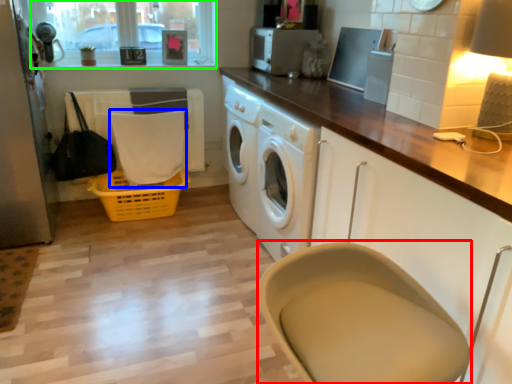
Question: Estimate the real-world distances between objects in this image. Which object is closer to feeding chair (highlighted by a red box), clothe (highlighted by a blue box) or window screen (highlighted by a green box)?

Choices:
 (A) clothe
 (B) window screen

Answer: (A)